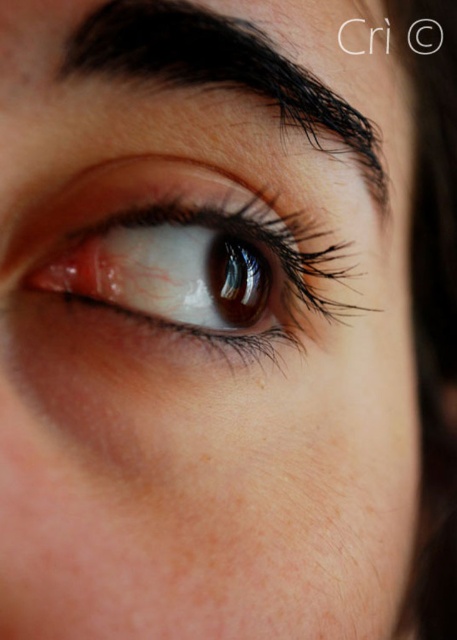
You are a makeup artist preparing to apply eyeliner to the brown glossy eye at center. The client has requested that the eyeliner should not touch the brown hair at upper center. Based on the image, is this possible?

The brown glossy eye at center is positioned under the brown hair at upper center, so it is possible to apply eyeliner without touching the hair as they are separate.

You are a photographer adjusting the focus of your camera. You have two points to focus on in the image of an eye. The first point is point (122, 221) and the second is point (265, 97). Which point should you focus on to ensure the closest part of the eye is in sharp focus?

Point (122, 221) is closer to the viewer than point (265, 97), so focusing on point (122, 221) will ensure the closest part of the eye is in sharp focus.